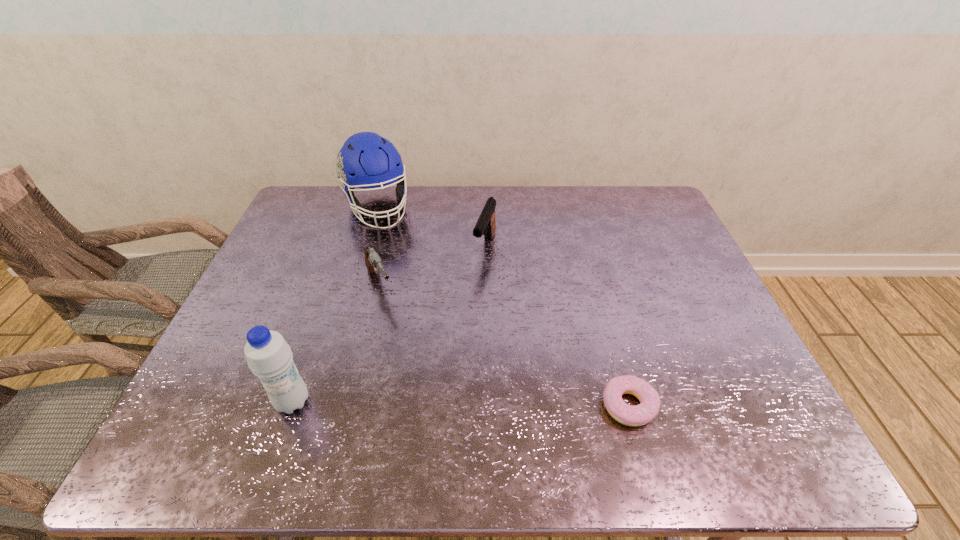
I want to click on water bottle located at the near edge, so click(x=269, y=356).

Identify the location of doughnut that is at the near edge. Image resolution: width=960 pixels, height=540 pixels. (641, 414).

Locate an element on the screen. vacant space at the far edge of the desktop is located at coordinates (434, 200).

In order to click on vacant space at the near edge of the desktop in this screenshot , I will do `click(378, 413)`.

The width and height of the screenshot is (960, 540). I want to click on free space at the left edge of the desktop, so pyautogui.click(x=246, y=301).

Identify the location of vacant region at the right edge of the desktop. This screenshot has height=540, width=960. (687, 313).

Locate an element on the screen. free space at the near left corner is located at coordinates (236, 388).

The width and height of the screenshot is (960, 540). I want to click on vacant space at the far right corner of the desktop, so click(x=637, y=195).

You are a GUI agent. You are given a task and a screenshot of the screen. Output one action in this format:
    pyautogui.click(x=<x>, y=<y>)
    Task: Click on the free spot between the taller pistol and the football helmet
    Image resolution: width=960 pixels, height=540 pixels.
    Given the screenshot: What is the action you would take?
    pyautogui.click(x=431, y=228)

I want to click on vacant space that's between the football helmet and the right pistol, so click(431, 228).